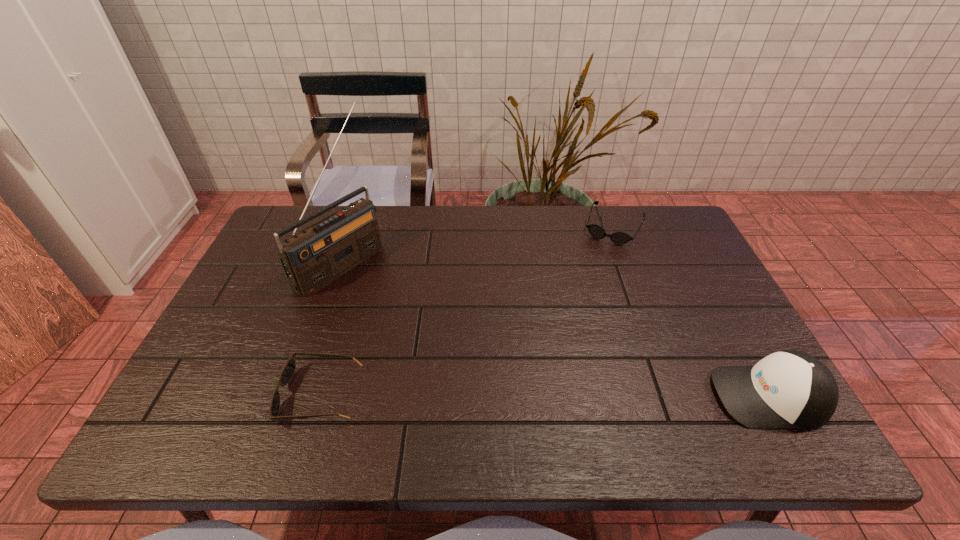
Find the location of `empty space that is in between the left sunglasses and the tallest object`. empty space that is in between the left sunglasses and the tallest object is located at coordinates (331, 329).

This screenshot has width=960, height=540. Identify the location of vacant space that's between the farther sunglasses and the cap. (691, 312).

Identify which object is located as the third nearest to the second tallest object. Please provide its 2D coordinates. Your answer should be formatted as a tuple, i.e. [(x, y)], where the tuple contains the x and y coordinates of a point satisfying the conditions above.

[(314, 257)]

The height and width of the screenshot is (540, 960). Identify the location of object that is the third closest one to the nearer sunglasses. (789, 389).

Identify the location of free space that satisfies the following two spatial constraints: 1. on the front side of the radio receiver; 2. on the front panel of the cap. Image resolution: width=960 pixels, height=540 pixels. (295, 396).

The width and height of the screenshot is (960, 540). I want to click on free space that satisfies the following two spatial constraints: 1. on the back side of the radio receiver; 2. on the right side of the farther sunglasses, so click(353, 227).

Find the location of a particular element. The width and height of the screenshot is (960, 540). free space that satisfies the following two spatial constraints: 1. on the front side of the right sunglasses; 2. on the front panel of the third shortest object is located at coordinates (676, 396).

Image resolution: width=960 pixels, height=540 pixels. I want to click on vacant space that satisfies the following two spatial constraints: 1. on the front side of the radio receiver; 2. on the front panel of the cap, so click(x=295, y=396).